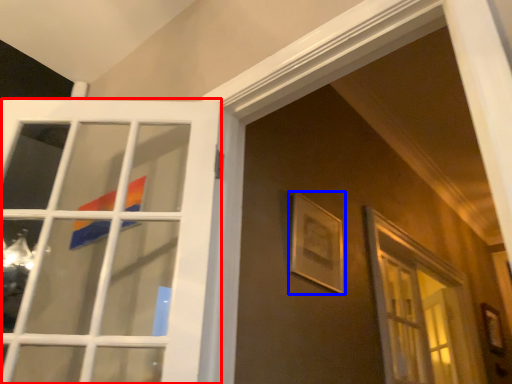
Question: Which point is further to the camera, door (highlighted by a red box) or picture frame (highlighted by a blue box)?

Choices:
 (A) door
 (B) picture frame

Answer: (B)